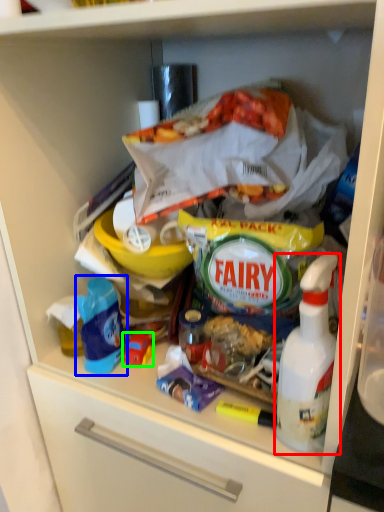
Question: Which object is positioned farthest from bottle (highlighted by a red box)? Select from product (highlighted by a blue box) and toy (highlighted by a green box).

Choices:
 (A) product
 (B) toy

Answer: (A)